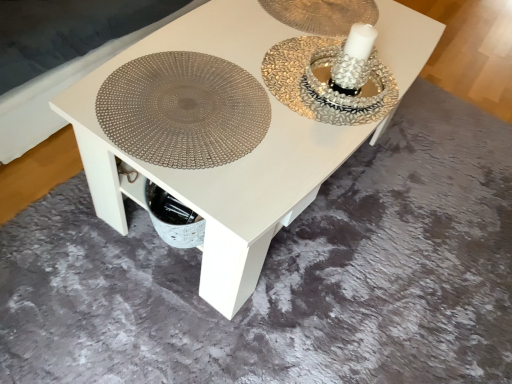
This screenshot has width=512, height=384. Find the location of `vacant area on the back side of matte silver platter at center`. vacant area on the back side of matte silver platter at center is located at coordinates (224, 32).